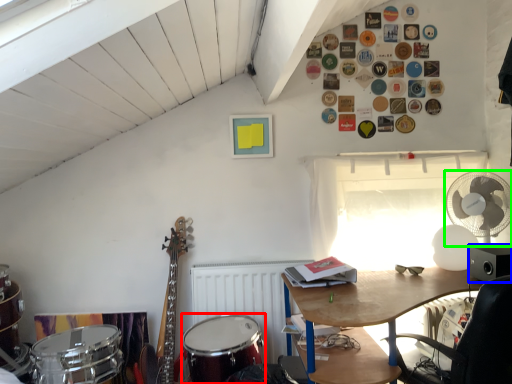
Question: Based on their relative distances, which object is farther from drum (highlighted by a red box)? Choose from loudspeaker (highlighted by a blue box) and mechanical fan (highlighted by a green box).

Choices:
 (A) loudspeaker
 (B) mechanical fan

Answer: (B)